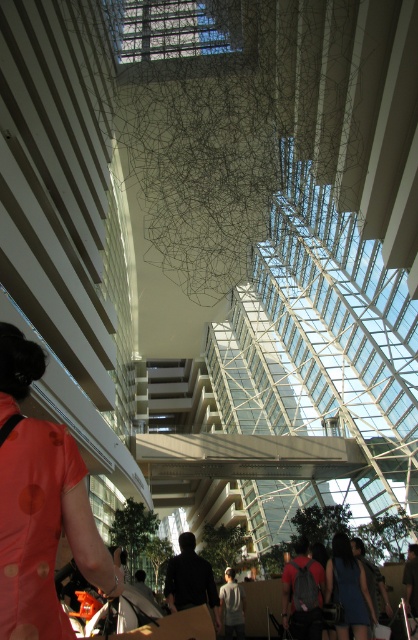
You are standing in the atrium and want to greet the person wearing the orange dotted shirt at lower left and the person in the blue denim dress at center. Which person should you approach first if you want to greet them in order from closest to farthest?

You should first greet the person wearing the orange dotted shirt at lower left because it is closer to you than the blue denim dress at center.